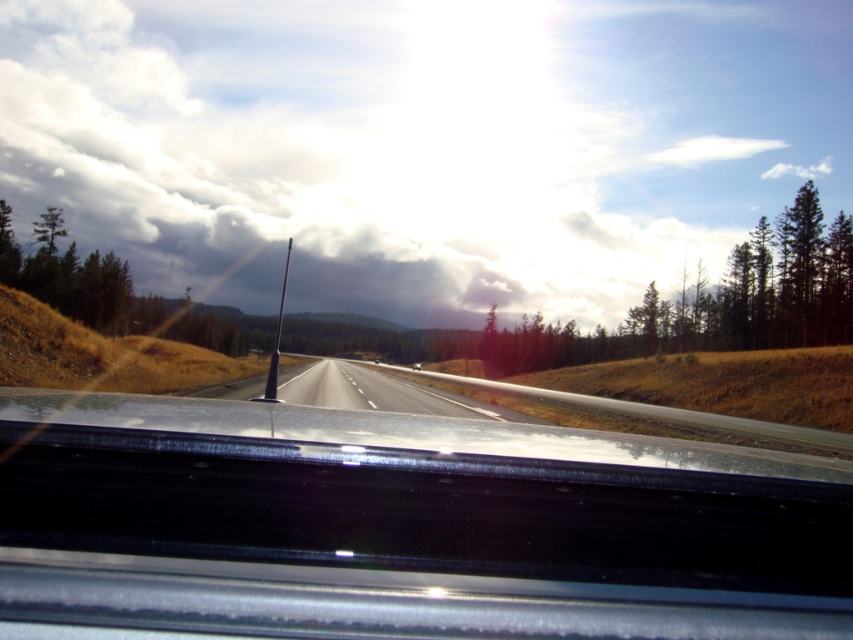
Question: Is white fluffy cloud at upper center positioned at the back of asphalt road at center?

Choices:
 (A) yes
 (B) no

Answer: (A)

Question: Which point is closer to the camera?

Choices:
 (A) (242, 116)
 (B) (334, 372)

Answer: (B)

Question: Is white fluffy cloud at upper center thinner than asphalt road at center?

Choices:
 (A) yes
 (B) no

Answer: (B)

Question: Among these objects, which one is farthest from the camera?

Choices:
 (A) asphalt road at center
 (B) white fluffy cloud at upper center

Answer: (B)

Question: Is white fluffy cloud at upper center smaller than asphalt road at center?

Choices:
 (A) no
 (B) yes

Answer: (A)